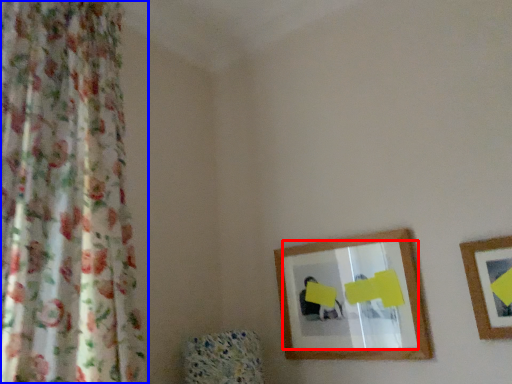
Question: Which point is further to the camera, mirror (highlighted by a red box) or curtain (highlighted by a blue box)?

Choices:
 (A) mirror
 (B) curtain

Answer: (A)